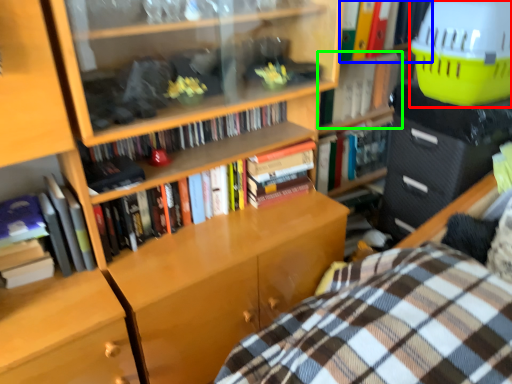
Question: Based on their relative distances, which object is farther from basket (highlighted by a red box)? Choose from book (highlighted by a blue box) and book (highlighted by a green box).

Choices:
 (A) book
 (B) book

Answer: (B)